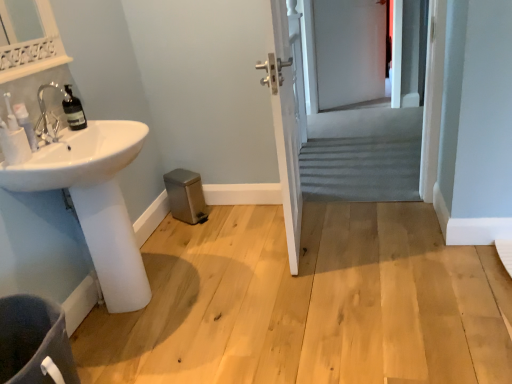
Identify the location of vacant area in front of white glossy sink at lower left. (148, 356).